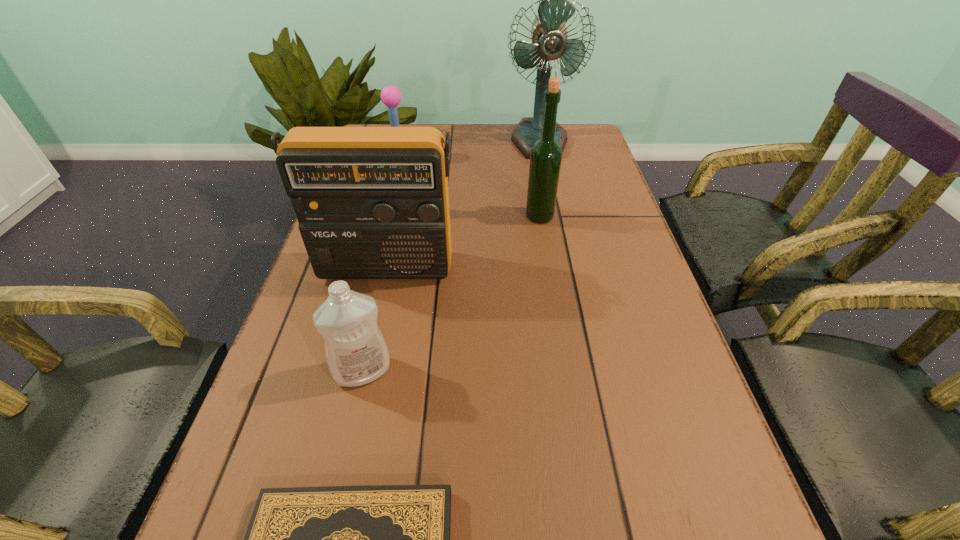
The height and width of the screenshot is (540, 960). What are the coordinates of `vacant space at the right edge of the desktop` in the screenshot? It's located at (646, 295).

Where is `free region at the far right corner of the desktop`? free region at the far right corner of the desktop is located at coordinates (596, 151).

Image resolution: width=960 pixels, height=540 pixels. What are the coordinates of `free space between the detergent and the tallest object` in the screenshot? It's located at (451, 256).

Find the location of a particular element. vacant space that is in between the tallest object and the joystick is located at coordinates (469, 150).

This screenshot has width=960, height=540. Identify the location of vacant space that's between the detergent and the liquor. (451, 294).

Locate an element on the screen. The width and height of the screenshot is (960, 540). vacant area between the detergent and the tallest object is located at coordinates (451, 256).

You are a GUI agent. You are given a task and a screenshot of the screen. Output one action in this format:
    pyautogui.click(x=<x>, y=<y>)
    Task: Click on the free spot between the radio receiver and the tallest object
    Image resolution: width=960 pixels, height=540 pixels.
    Given the screenshot: What is the action you would take?
    pyautogui.click(x=463, y=204)

Locate an element on the screen. The height and width of the screenshot is (540, 960). object identified as the fifth closest to the nearest object is located at coordinates (549, 34).

The height and width of the screenshot is (540, 960). Identify the location of object that stands as the fourth closest to the joystick. (356, 352).

Where is `blank space that satisfies the following two spatial constraints: 1. forward from the base of the fourth nearest object; 2. on the left side of the joystick`? This screenshot has height=540, width=960. blank space that satisfies the following two spatial constraints: 1. forward from the base of the fourth nearest object; 2. on the left side of the joystick is located at coordinates (384, 217).